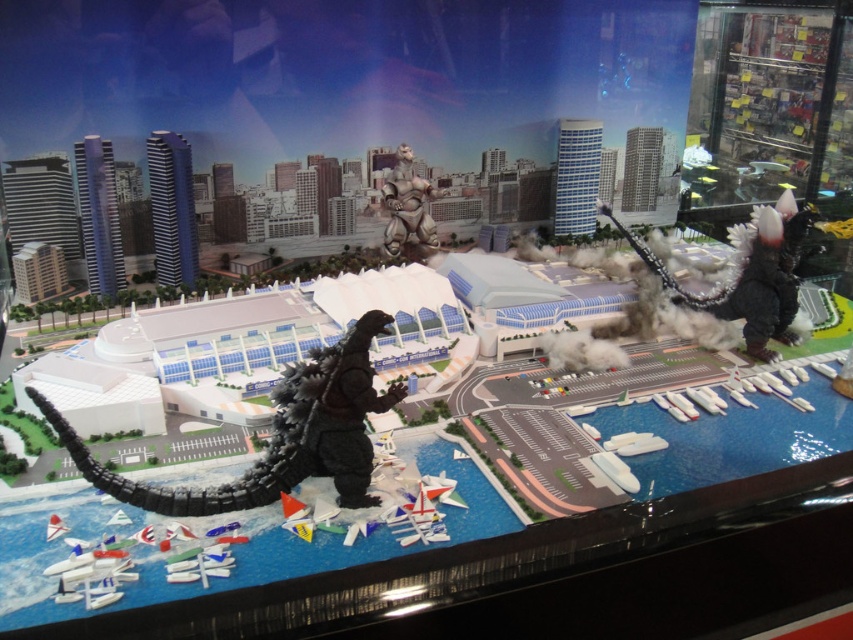
You are a collector who wants to place a new toy on the display case. You have a black matte toy at center and a satin black godzilla at right. Which toy is bigger?

The satin black godzilla at right is bigger than the black matte toy at center.

Consider the image. You are a curator preparing to install a protective glass cover over the miniature diorama. The glass cover has a height limit of 12 inches. Given the black matte toy at center and the metallic silver robot at center, will the glass cover accommodate both figures without any issues?

The black matte toy at center is not as tall as the metallic silver robot at center. Since the glass cover has a height limit of 12 inches, we need to know the height of the metallic silver robot at center to determine if it fits. However, the provided information does not specify the exact height of either figure, only their relative sizes. Therefore, it is uncertain if the glass cover will accommodate both figures without issues.